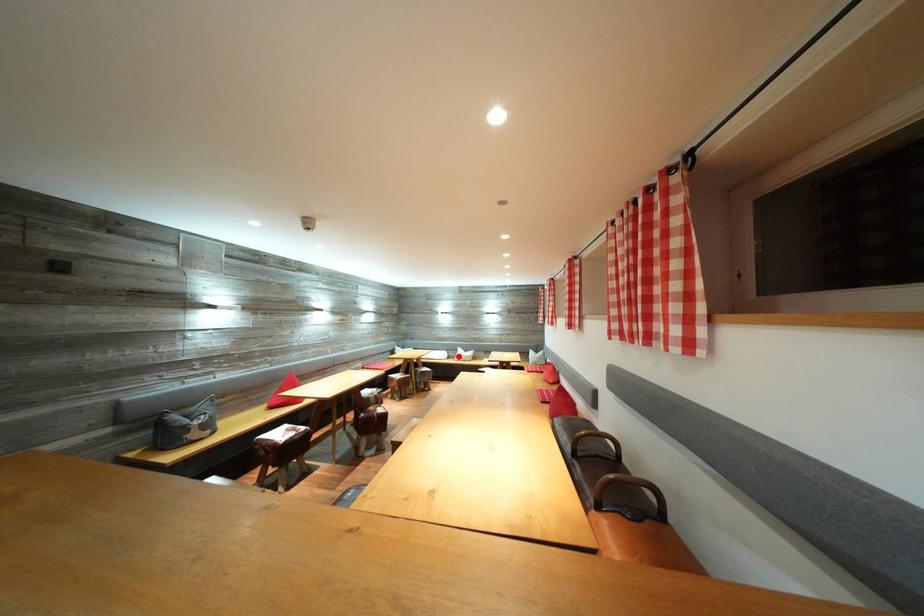
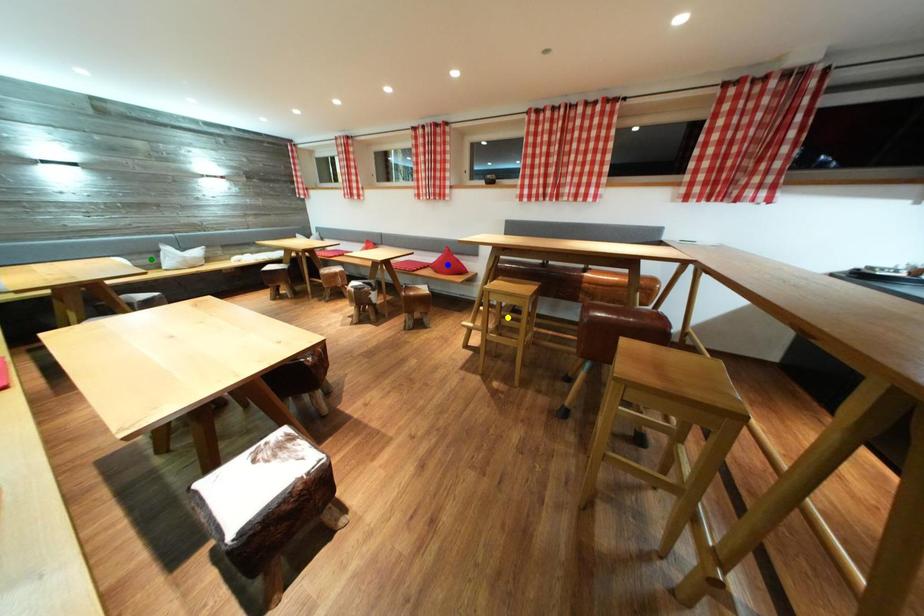
Question: I am providing you with two images of the same scene from different viewpoints. A red point is marked on the first image. You are given multiple points on the second image. Which mark in image 2 goes with the point in image 1?

Choices:
 (A) yellow point
 (B) green point
 (C) blue point

Answer: (B)